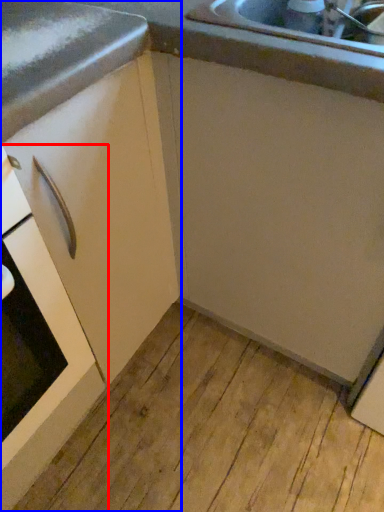
Question: Which of the following is the farthest to the observer, home appliance (highlighted by a red box) or cabinetry (highlighted by a blue box)?

Choices:
 (A) home appliance
 (B) cabinetry

Answer: (B)